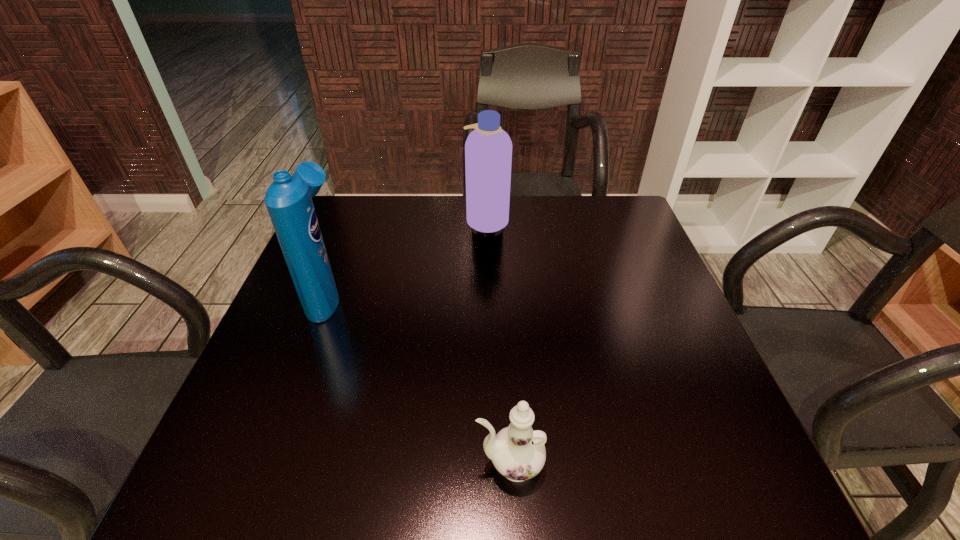
At what (x,y) coordinates should I click in order to perform the action: click on free space located at the spout of the nearest object. Please return your answer as a coordinate pair (x, y). This screenshot has width=960, height=540. Looking at the image, I should click on (335, 465).

Find the location of `object that is at the far edge`. object that is at the far edge is located at coordinates (488, 149).

Identify the location of object that is at the near edge. (518, 452).

I want to click on object located at the left edge, so click(x=288, y=199).

In the image, there is a desktop. At what (x,y) coordinates should I click in order to perform the action: click on vacant space at the far edge. Please return your answer as a coordinate pair (x, y). Looking at the image, I should click on (534, 199).

In the image, there is a desktop. In order to click on free space at the near edge in this screenshot , I will do `click(347, 485)`.

Locate an element on the screen. free region at the left edge is located at coordinates (296, 368).

You are a GUI agent. You are given a task and a screenshot of the screen. Output one action in this format:
    pyautogui.click(x=<x>, y=<y>)
    Task: Click on the vacant space at the right edge of the desktop
    
    Given the screenshot: What is the action you would take?
    [703, 371]

In the image, there is a desktop. Find the location of `vacant space at the near left corner`. vacant space at the near left corner is located at coordinates (219, 473).

Where is `vacant region between the chinaware and the nearer shampoo`? The height and width of the screenshot is (540, 960). vacant region between the chinaware and the nearer shampoo is located at coordinates (419, 380).